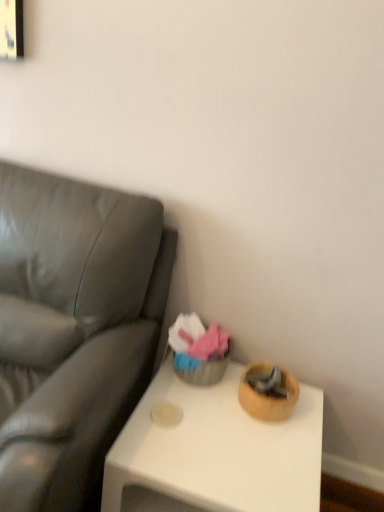
What is the approximate width of leather-like gray couch at left?

It is 37.88 inches.

I want to click on leather-like gray couch at left, so click(72, 329).

The height and width of the screenshot is (512, 384). What do you see at coordinates (72, 329) in the screenshot? I see `leather-like gray couch at left` at bounding box center [72, 329].

Describe the element at coordinates (215, 452) in the screenshot. The width and height of the screenshot is (384, 512). I see `wooden bowl at lower right` at that location.

What is the approximate width of wooden bowl at lower right?

wooden bowl at lower right is 24.35 inches wide.

Locate an element on the screen. This screenshot has height=512, width=384. wooden bowl at lower right is located at coordinates (215, 452).

At what (x,y) coordinates should I click in order to perform the action: click on leather-like gray couch at left. Please return your answer as a coordinate pair (x, y). Image resolution: width=384 pixels, height=512 pixels. Looking at the image, I should click on (72, 329).

Based on the photo, considering the positions of objects wooden bowl at lower right and leather-like gray couch at left in the image provided, who is more to the left, wooden bowl at lower right or leather-like gray couch at left?

leather-like gray couch at left.

Considering the positions of objects wooden bowl at lower right and leather-like gray couch at left in the image provided, who is behind, wooden bowl at lower right or leather-like gray couch at left?

wooden bowl at lower right is further away from the camera.

Which is nearer, (138, 465) or (90, 237)?

Point (138, 465) is closer to the camera than point (90, 237).

From the image's perspective, would you say wooden bowl at lower right is positioned over leather-like gray couch at left?

No.

From a real-world perspective, is wooden bowl at lower right physically above leather-like gray couch at left?

No, from a real-world perspective, wooden bowl at lower right is not on top of leather-like gray couch at left.

Is wooden bowl at lower right wider than leather-like gray couch at left?

In fact, wooden bowl at lower right might be narrower than leather-like gray couch at left.

From their relative heights in the image, would you say wooden bowl at lower right is taller or shorter than leather-like gray couch at left?

Clearly, wooden bowl at lower right is shorter compared to leather-like gray couch at left.

Is wooden bowl at lower right smaller than leather-like gray couch at left?

Correct, wooden bowl at lower right occupies less space than leather-like gray couch at left.

Would you say wooden bowl at lower right is outside leather-like gray couch at left?

Yes, wooden bowl at lower right is outside of leather-like gray couch at left.

Is wooden bowl at lower right far from leather-like gray couch at left?

No, there isn't a large distance between wooden bowl at lower right and leather-like gray couch at left.

Does wooden bowl at lower right turn towards leather-like gray couch at left?

No, wooden bowl at lower right is not aimed at leather-like gray couch at left.

Measure the distance between wooden bowl at lower right and leather-like gray couch at left.

wooden bowl at lower right and leather-like gray couch at left are 14.55 inches apart from each other.

The image size is (384, 512). I want to click on table behind the leather-like gray couch at left, so click(215, 452).

In the scene shown: Can you confirm if leather-like gray couch at left is positioned to the left of wooden bowl at lower right?

Yes, leather-like gray couch at left is to the left of wooden bowl at lower right.

Considering the positions of objects leather-like gray couch at left and wooden bowl at lower right in the image provided, who is behind, leather-like gray couch at left or wooden bowl at lower right?

wooden bowl at lower right is further away from the camera.

Is point (89, 450) farther from viewer compared to point (218, 398)?

No, (89, 450) is closer to viewer.

From the image's perspective, which is below, leather-like gray couch at left or wooden bowl at lower right?

From the image's view, wooden bowl at lower right is below.

From a real-world perspective, is leather-like gray couch at left under wooden bowl at lower right?

No.

Which object is wider, leather-like gray couch at left or wooden bowl at lower right?

leather-like gray couch at left is wider.

Which of these two, leather-like gray couch at left or wooden bowl at lower right, stands taller?

Standing taller between the two is leather-like gray couch at left.

Who is bigger, leather-like gray couch at left or wooden bowl at lower right?

Bigger between the two is leather-like gray couch at left.

Is leather-like gray couch at left inside the boundaries of wooden bowl at lower right, or outside?

leather-like gray couch at left is not enclosed by wooden bowl at lower right.

Is leather-like gray couch at left positioned far away from wooden bowl at lower right?

No, leather-like gray couch at left is not far from wooden bowl at lower right.

Is leather-like gray couch at left oriented away from wooden bowl at lower right?

No.

I want to click on table below the leather-like gray couch at left (from the image's perspective), so click(x=215, y=452).

Locate an element on the screen. table below the leather-like gray couch at left (from the image's perspective) is located at coordinates (215, 452).

Locate an element on the screen. Image resolution: width=384 pixels, height=512 pixels. studio couch in front of the wooden bowl at lower right is located at coordinates (72, 329).